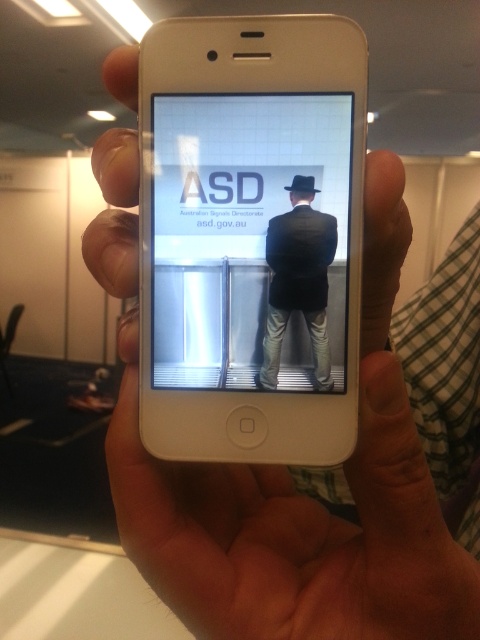
Is white glossy poster at center in front of dark suit at center?

Yes, white glossy poster at center is closer to the viewer.

Does point (206, 180) lie in front of point (315, 369)?

No, (206, 180) is behind (315, 369).

The image size is (480, 640). What are the coordinates of `white glossy poster at center` in the screenshot? It's located at (240, 228).